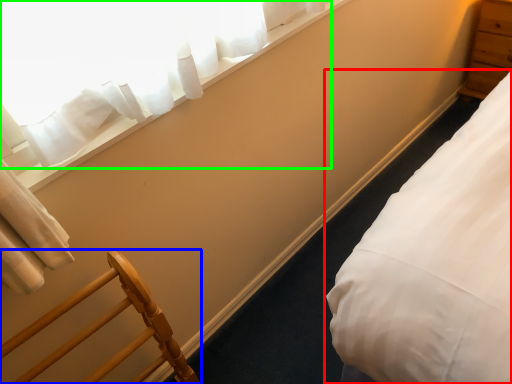
Question: Which object is the closest to the bed (highlighted by a red box)? Choose among these: furniture (highlighted by a blue box) or curtain (highlighted by a green box).

Choices:
 (A) furniture
 (B) curtain

Answer: (A)